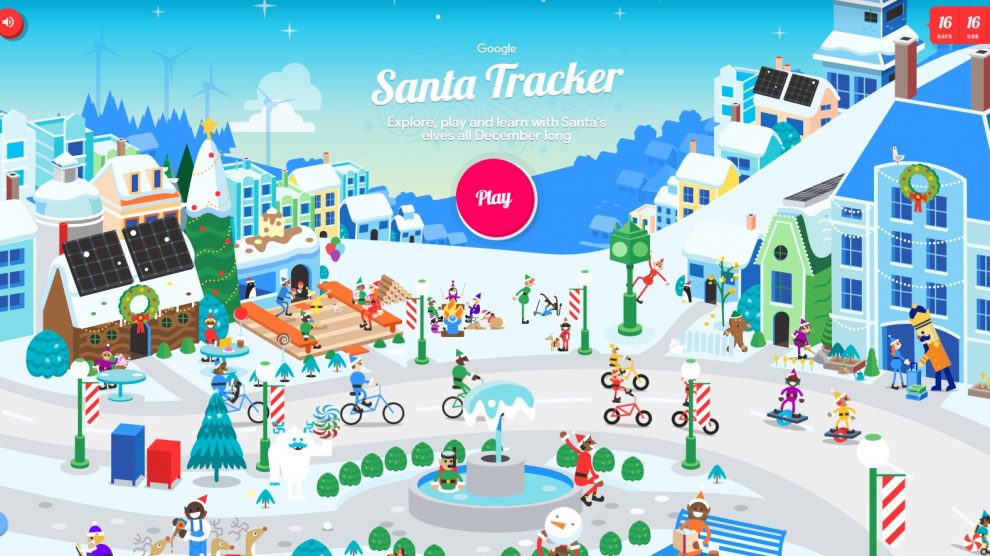
Image resolution: width=990 pixels, height=556 pixels. In order to click on black door in this screenshot , I will do pos(141,345).